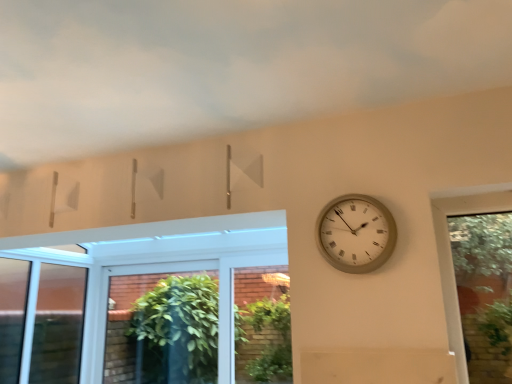
Question: Can you confirm if cloudy sky at upper center is wider than beige textured clock at right?

Choices:
 (A) no
 (B) yes

Answer: (B)

Question: From a real-world perspective, is cloudy sky at upper center on top of beige textured clock at right?

Choices:
 (A) no
 (B) yes

Answer: (B)

Question: Is cloudy sky at upper center at the left side of beige textured clock at right?

Choices:
 (A) no
 (B) yes

Answer: (B)

Question: Is cloudy sky at upper center closer to the viewer compared to beige textured clock at right?

Choices:
 (A) no
 (B) yes

Answer: (B)

Question: From the image's perspective, is cloudy sky at upper center on top of beige textured clock at right?

Choices:
 (A) no
 (B) yes

Answer: (B)

Question: Does cloudy sky at upper center touch beige textured clock at right?

Choices:
 (A) yes
 (B) no

Answer: (B)

Question: From the image's perspective, would you say green leafy plant at lower center is shown under cloudy sky at upper center?

Choices:
 (A) no
 (B) yes

Answer: (B)

Question: Is green leafy plant at lower center oriented away from cloudy sky at upper center?

Choices:
 (A) no
 (B) yes

Answer: (A)

Question: From the image's perspective, is green leafy plant at lower center on cloudy sky at upper center?

Choices:
 (A) yes
 (B) no

Answer: (B)

Question: Does green leafy plant at lower center appear on the right side of cloudy sky at upper center?

Choices:
 (A) no
 (B) yes

Answer: (B)

Question: Is green leafy plant at lower center taller than cloudy sky at upper center?

Choices:
 (A) no
 (B) yes

Answer: (B)

Question: Can you confirm if green leafy plant at lower center is wider than cloudy sky at upper center?

Choices:
 (A) no
 (B) yes

Answer: (A)

Question: Can you confirm if beige textured clock at right is smaller than cloudy sky at upper center?

Choices:
 (A) yes
 (B) no

Answer: (A)